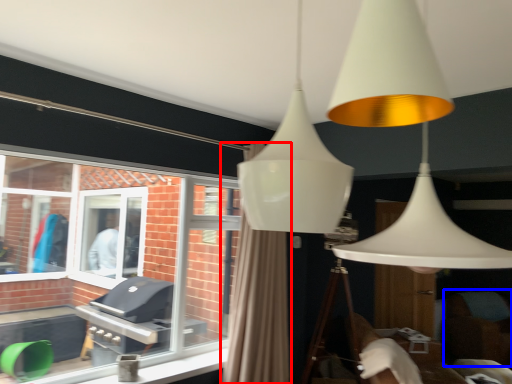
Question: Which object is closer to the camera taking this photo, curtain (highlighted by a red box) or swivel chair (highlighted by a blue box)?

Choices:
 (A) curtain
 (B) swivel chair

Answer: (A)